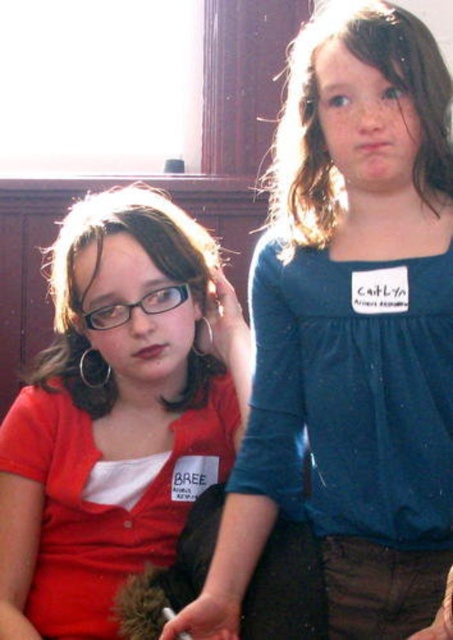
Which is in front, point (318, 76) or point (125, 436)?

Positioned in front is point (318, 76).

Between matte blue shirt at upper right and matte red shirt at left, which one has less height?

matte red shirt at left

Find the location of a particular element. The height and width of the screenshot is (640, 453). matte blue shirt at upper right is located at coordinates (351, 332).